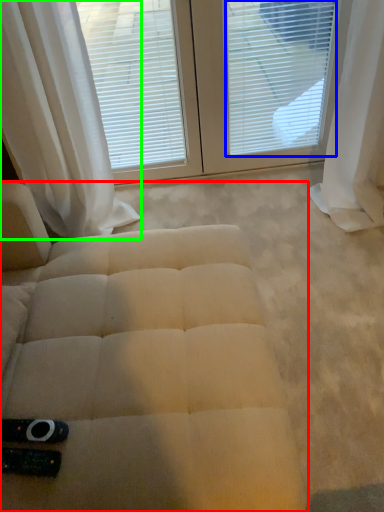
Question: Which object is positioned farthest from furniture (highlighted by a red box)? Select from blind (highlighted by a blue box) and curtain (highlighted by a green box).

Choices:
 (A) blind
 (B) curtain

Answer: (A)